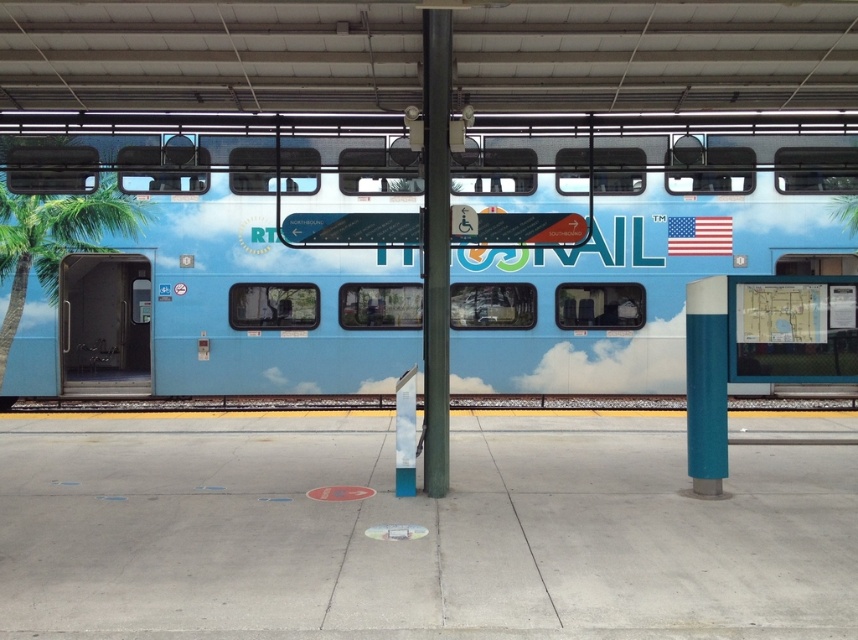
You are standing at the train station platform and want to locate the green painted metal pole at center. According to the coordinates provided, where should you look?

The green painted metal pole at center is located at point coordinates (x=434, y=248).

You are waiting at the train station and notice the light blue glossy train at center and the green leafy palm tree at left. Which object is positioned higher from the ground?

The green leafy palm tree at left is positioned higher from the ground than the light blue glossy train at center because the light blue glossy train at center is located below it.